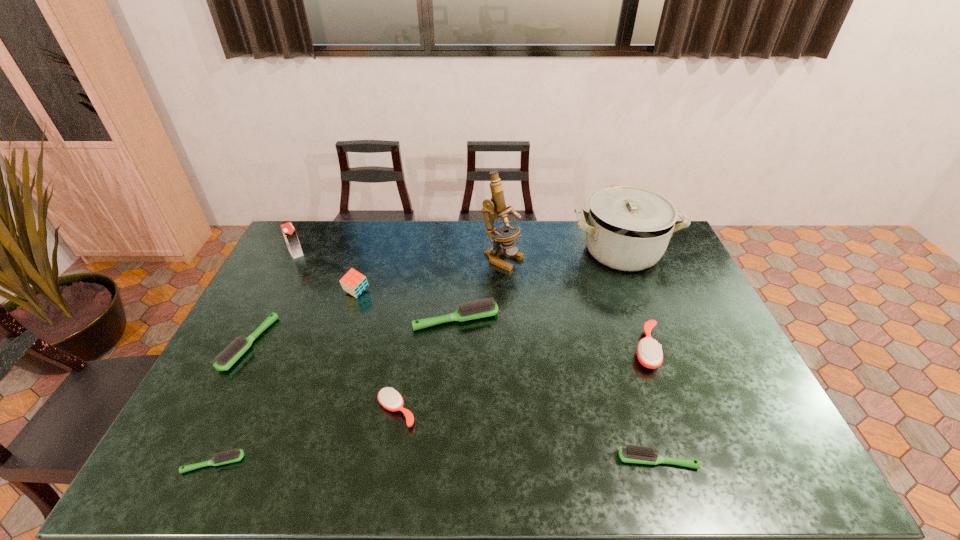
Find the location of `the closest object to the rightmost light hairbrush`. the closest object to the rightmost light hairbrush is located at coordinates (649, 353).

Identify which object is the seventh closest to the biggest light hairbrush. Please provide its 2D coordinates. Your answer should be formatted as a tuple, i.e. [(x, y)], where the tuple contains the x and y coordinates of a point satisfying the conditions above.

[(632, 454)]

Select which hairbrush appears as the third closest to the rightmost light hairbrush. Please provide its 2D coordinates. Your answer should be formatted as a tuple, i.e. [(x, y)], where the tuple contains the x and y coordinates of a point satisfying the conditions above.

[(389, 398)]

Find the location of a particular element. hairbrush that is the fourth closest one to the rightmost light hairbrush is located at coordinates (229, 456).

Locate which light hairbrush ranks fourth in proximity to the farther orange hairbrush. Please provide its 2D coordinates. Your answer should be formatted as a tuple, i.e. [(x, y)], where the tuple contains the x and y coordinates of a point satisfying the conditions above.

[(226, 358)]

Identify the location of the third closest light hairbrush to the shortest object. The width and height of the screenshot is (960, 540). (632, 454).

Identify the location of vacant area in the image that satisfies the following two spatial constraints: 1. on the front side of the biggest light hairbrush; 2. on the right side of the red cube. (348, 319).

Locate an element on the screen. The image size is (960, 540). free location that satisfies the following two spatial constraints: 1. on the back side of the shortest object; 2. on the right side of the cube is located at coordinates (294, 293).